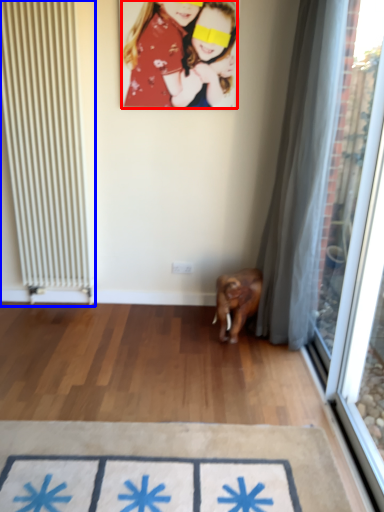
Question: Which of the following is the closest to the observer, person (highlighted by a red box) or radiator (highlighted by a blue box)?

Choices:
 (A) person
 (B) radiator

Answer: (B)